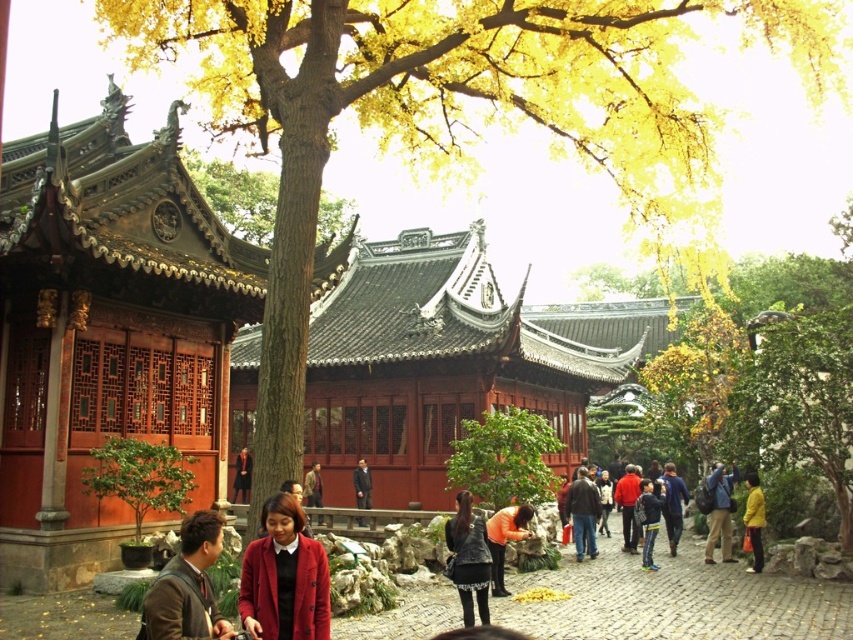
Between cobblestone path at center and brown leather backpack at lower right, which one appears on the right side from the viewer's perspective?

brown leather backpack at lower right is more to the right.

Is cobblestone path at center wider than brown leather backpack at lower right?

Indeed, cobblestone path at center has a greater width compared to brown leather backpack at lower right.

You are a GUI agent. You are given a task and a screenshot of the screen. Output one action in this format:
    pyautogui.click(x=<x>, y=<y>)
    Task: Click on the cobblestone path at center
    
    Given the screenshot: What is the action you would take?
    pyautogui.click(x=675, y=600)

Is the position of blue denim jacket at center more distant than that of red velvet coat at center?

No.

Does point (662, 483) come farther from viewer compared to point (247, 458)?

No, (662, 483) is in front of (247, 458).

Describe the element at coordinates (672, 504) in the screenshot. Image resolution: width=853 pixels, height=640 pixels. I see `blue denim jacket at center` at that location.

This screenshot has width=853, height=640. What are the coordinates of `blue denim jacket at center` in the screenshot? It's located at (672, 504).

Based on the photo, who is more forward, [553,484] or [364,524]?

Positioned in front is point [553,484].

Does green leafy tree at center have a smaller size compared to dark gray suit at center?

No, green leafy tree at center is not smaller than dark gray suit at center.

Is point (512, 464) closer to viewer compared to point (360, 497)?

Yes.

Locate an element on the screen. green leafy tree at center is located at coordinates (503, 458).